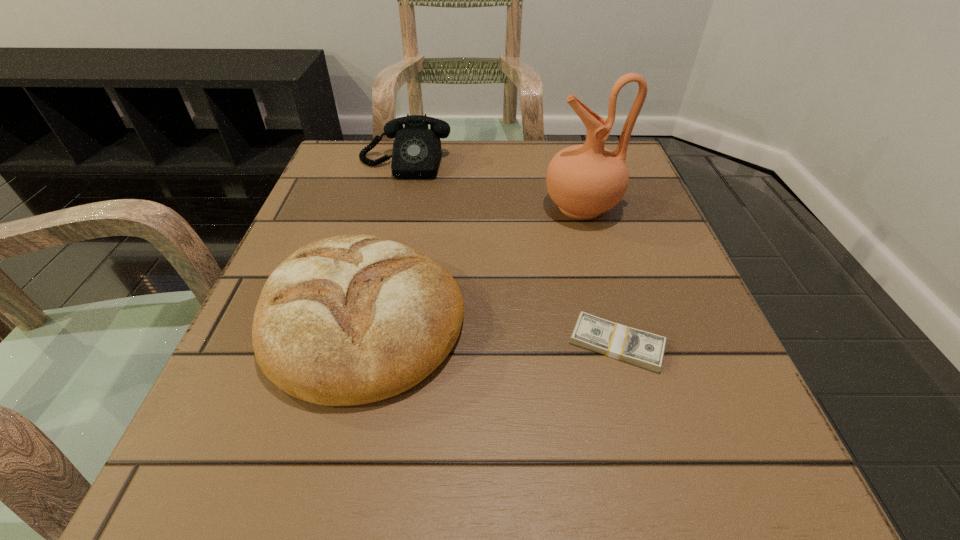
This screenshot has height=540, width=960. What are the coordinates of `free region located on the front of the shortest object` in the screenshot? It's located at (657, 485).

In order to click on pottery that is positioned at the far edge in this screenshot , I will do click(585, 180).

Locate an element on the screen. telephone that is at the far edge is located at coordinates (416, 154).

Find the location of `telephone that is positioned at the left edge`. telephone that is positioned at the left edge is located at coordinates (416, 154).

Image resolution: width=960 pixels, height=540 pixels. I want to click on bread at the left edge, so click(353, 319).

Where is `pottery at the right edge`? The width and height of the screenshot is (960, 540). pottery at the right edge is located at coordinates (585, 180).

The image size is (960, 540). In order to click on dollar that is at the right edge in this screenshot , I will do `click(640, 348)`.

At what (x,y) coordinates should I click in order to perform the action: click on object that is at the far left corner. Please return your answer as a coordinate pair (x, y). This screenshot has width=960, height=540. Looking at the image, I should click on (416, 154).

Locate an element on the screen. The width and height of the screenshot is (960, 540). object located at the far right corner is located at coordinates (585, 180).

Locate an element on the screen. The image size is (960, 540). vacant space at the far edge is located at coordinates (543, 167).